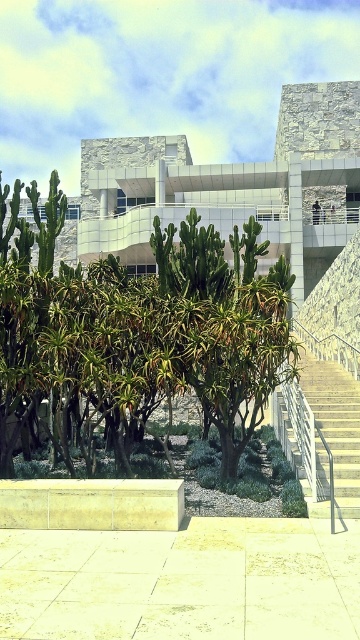
This screenshot has height=640, width=360. Describe the element at coordinates (146, 339) in the screenshot. I see `green leafy tree at center` at that location.

Who is shorter, green leafy tree at center or white concrete stairs at right?

With less height is green leafy tree at center.

I want to click on green leafy tree at center, so click(146, 339).

Identify the location of green leafy tree at center. This screenshot has width=360, height=640. (146, 339).